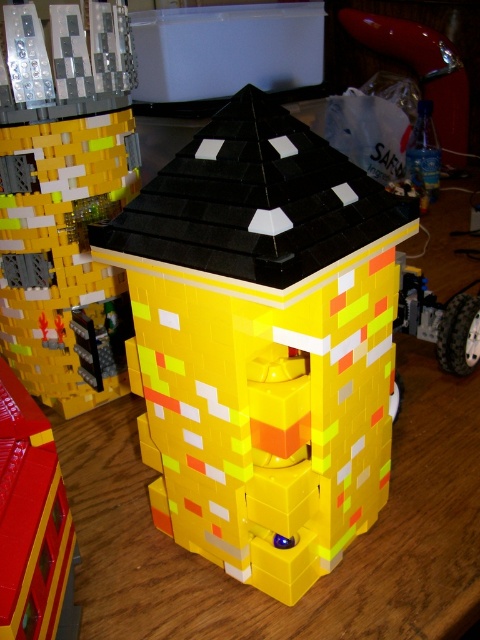
Is yellow plastic toy at center positioned at the back of yellow matte building at center?

No, it is in front of yellow matte building at center.

Which is above, yellow plastic toy at center or yellow matte building at center?

yellow matte building at center

Is point (354, 445) in front of point (68, 300)?

Yes, point (354, 445) is in front of point (68, 300).

Identify the location of yellow plastic toy at center. This screenshot has height=640, width=480. (264, 340).

Is the position of yellow matte building at center less distant than that of brick-like yellow toy at lower left?

No.

Does yellow matte building at center have a smaller size compared to brick-like yellow toy at lower left?

Incorrect, yellow matte building at center is not smaller in size than brick-like yellow toy at lower left.

Locate an element on the screen. Image resolution: width=480 pixels, height=640 pixels. yellow matte building at center is located at coordinates (64, 198).

Who is shorter, yellow plastic toy at center or brick-like yellow toy at lower left?

brick-like yellow toy at lower left is shorter.

How far apart are yellow plastic toy at center and brick-like yellow toy at lower left?

yellow plastic toy at center and brick-like yellow toy at lower left are 7.80 inches apart from each other.

Does point (227, 486) come behind point (67, 564)?

Yes, point (227, 486) is farther from viewer.

The image size is (480, 640). I want to click on yellow plastic toy at center, so click(264, 340).